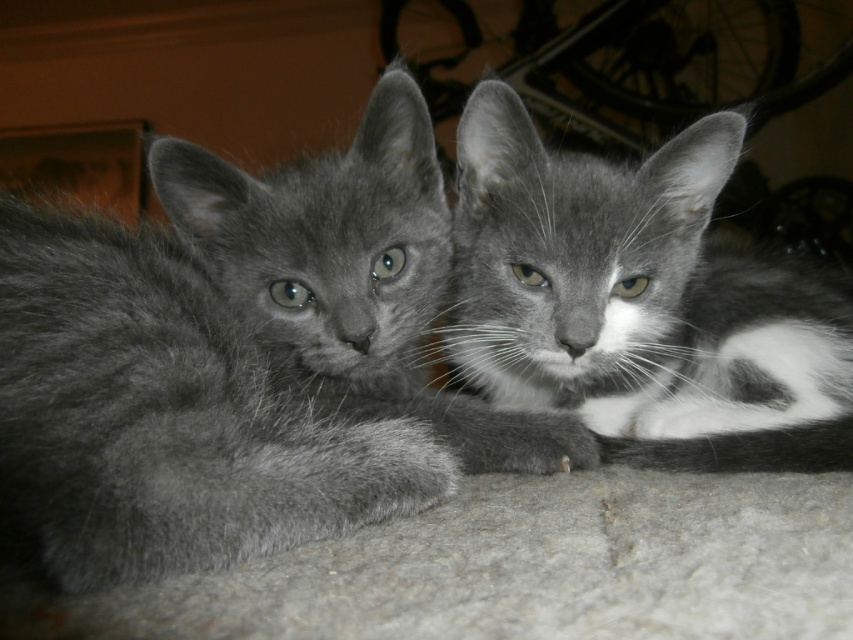
Question: Which of the following is the closest to the observer?

Choices:
 (A) (421, 248)
 (B) (554, 156)

Answer: (A)

Question: Does soft gray fur cat at center have a larger size compared to gray fur cat at center?

Choices:
 (A) no
 (B) yes

Answer: (B)

Question: Where is soft gray fur cat at center located in relation to gray fur cat at center in the image?

Choices:
 (A) above
 (B) below

Answer: (B)

Question: Does soft gray fur cat at center appear over gray fur cat at center?

Choices:
 (A) no
 (B) yes

Answer: (A)

Question: Which point is farther from the camera taking this photo?

Choices:
 (A) (335, 179)
 (B) (532, 132)

Answer: (B)